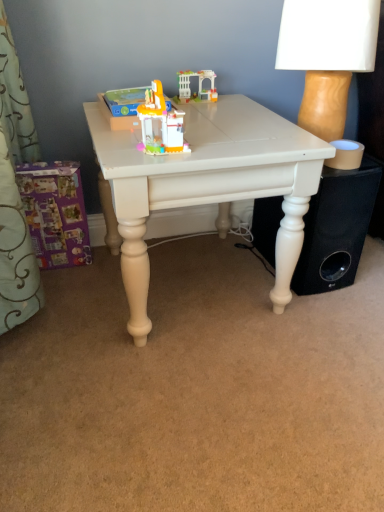
Find the location of a particular element. This screenshot has width=384, height=512. free space on the front side of purple cardboard box at lower left, acting as the 2th toy starting from the back is located at coordinates (64, 293).